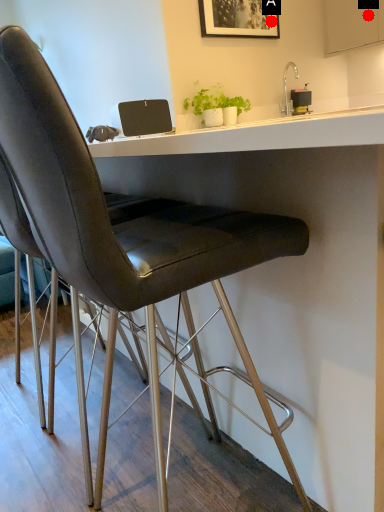
Question: Two points are circled on the image, labeled by A and B beside each circle. Which point is closer to the camera taking this photo?

Choices:
 (A) A is closer
 (B) B is closer

Answer: (B)